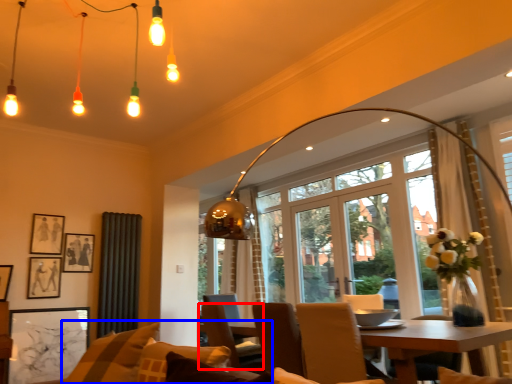
Question: Among these objects, which one is farthest to the camera, chair (highlighted by a red box) or couch (highlighted by a blue box)?

Choices:
 (A) chair
 (B) couch

Answer: (A)